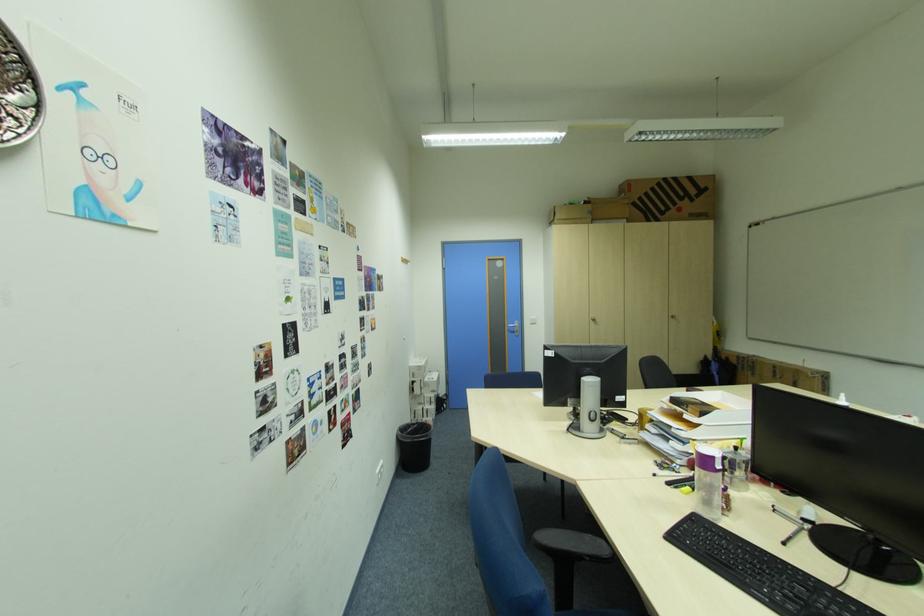
Find the location of `plastic water bottle`. plastic water bottle is located at coordinates (708, 482).